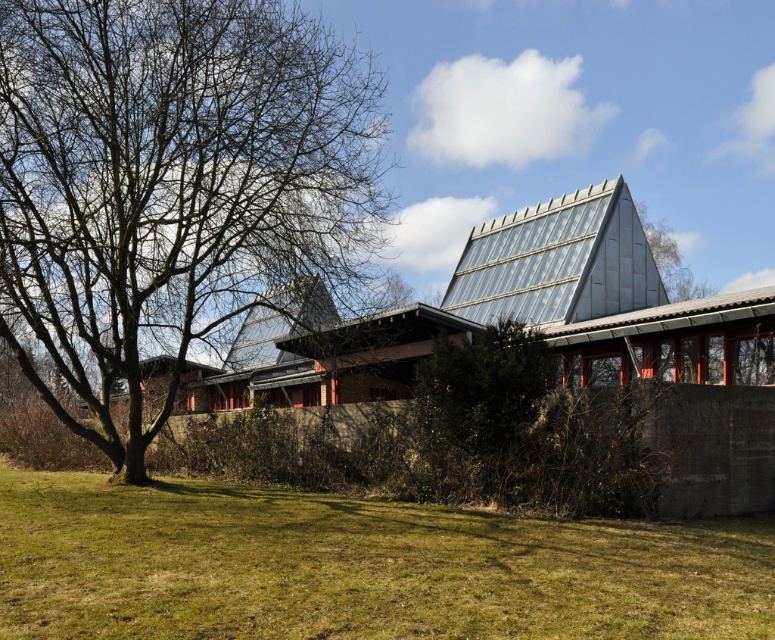
Is green grass at lower center closer to the viewer compared to green leafy tree at upper center?

Yes, green grass at lower center is closer to the viewer.

Which is more to the right, green grass at lower center or green leafy tree at upper center?

Positioned to the right is green leafy tree at upper center.

Does point (388, 592) lie behind point (674, 280)?

That is False.

In order to click on green grass at lower center in this screenshot , I will do `click(357, 566)`.

Does bare wood tree at left appear on the right side of green grass at lower center?

Incorrect, bare wood tree at left is not on the right side of green grass at lower center.

Does point (388, 205) come behind point (667, 624)?

That is True.

What do you see at coordinates (171, 188) in the screenshot? I see `bare wood tree at left` at bounding box center [171, 188].

Locate an element on the screen. The image size is (775, 640). bare wood tree at left is located at coordinates click(x=171, y=188).

In the scene shown: Can you confirm if green grass at lower center is thinner than green leafy bush at center?

No, green grass at lower center is not thinner than green leafy bush at center.

Between point (689, 632) and point (534, 342), which one is positioned in front?

Point (689, 632)

Where is `green grass at lower center`? green grass at lower center is located at coordinates (357, 566).